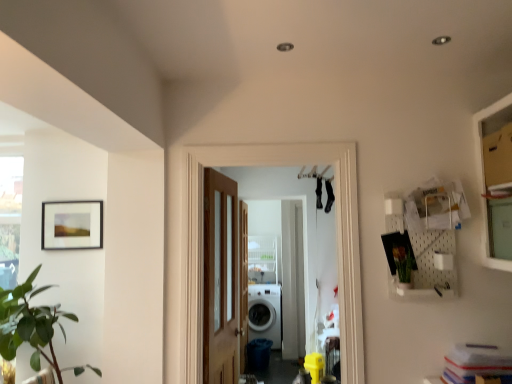
Question: From the image's perspective, does white pegboard at upper right appear higher than green matte vase at right?

Choices:
 (A) no
 (B) yes

Answer: (B)

Question: Is white pegboard at upper right smaller than green matte vase at right?

Choices:
 (A) no
 (B) yes

Answer: (A)

Question: Does white pegboard at upper right appear on the left side of green matte vase at right?

Choices:
 (A) yes
 (B) no

Answer: (B)

Question: Is white pegboard at upper right completely or partially outside of green matte vase at right?

Choices:
 (A) yes
 (B) no

Answer: (A)

Question: Is white pegboard at upper right closer to the viewer compared to green matte vase at right?

Choices:
 (A) yes
 (B) no

Answer: (B)

Question: Does point (442, 198) appear closer or farther from the camera than point (241, 248)?

Choices:
 (A) closer
 (B) farther

Answer: (A)

Question: Is white pegboard at upper right inside the boundaries of clear glass screen door at center, or outside?

Choices:
 (A) inside
 (B) outside

Answer: (B)

Question: From their relative heights in the image, would you say white pegboard at upper right is taller or shorter than clear glass screen door at center?

Choices:
 (A) tall
 (B) short

Answer: (B)

Question: Considering the positions of white pegboard at upper right and clear glass screen door at center in the image, is white pegboard at upper right bigger or smaller than clear glass screen door at center?

Choices:
 (A) small
 (B) big

Answer: (A)

Question: From a real-world perspective, relative to clear glass screen door at center, is matte black picture frame at upper left vertically above or below?

Choices:
 (A) above
 (B) below

Answer: (A)

Question: In the image, is matte black picture frame at upper left positioned in front of or behind clear glass screen door at center?

Choices:
 (A) front
 (B) behind

Answer: (A)

Question: Considering the positions of matte black picture frame at upper left and clear glass screen door at center in the image, is matte black picture frame at upper left wider or thinner than clear glass screen door at center?

Choices:
 (A) wide
 (B) thin

Answer: (B)

Question: Is matte black picture frame at upper left taller or shorter than clear glass screen door at center?

Choices:
 (A) tall
 (B) short

Answer: (B)

Question: Considering the positions of green leafy plant at left and clear glass screen door at center in the image, is green leafy plant at left taller or shorter than clear glass screen door at center?

Choices:
 (A) short
 (B) tall

Answer: (A)

Question: From the image's perspective, is green leafy plant at left located above or below clear glass screen door at center?

Choices:
 (A) above
 (B) below

Answer: (A)